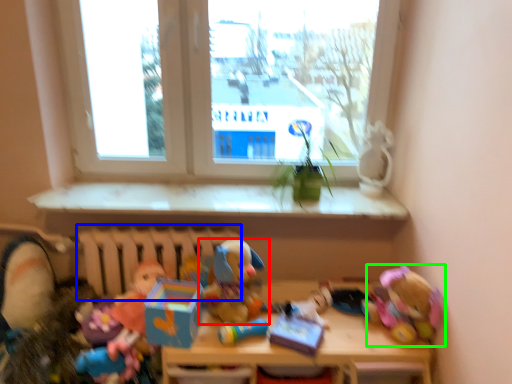
Question: Which object is positioned farthest from toy (highlighted by a red box)? Select from radiator (highlighted by a blue box) and toy (highlighted by a green box).

Choices:
 (A) radiator
 (B) toy

Answer: (B)